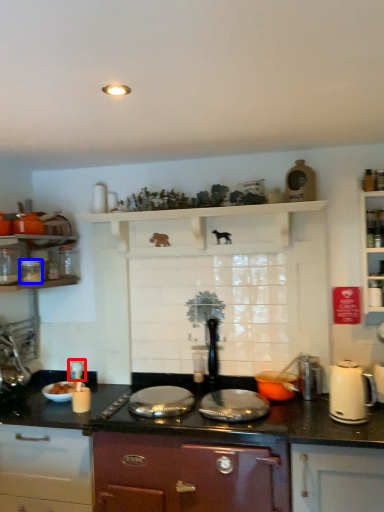
Question: Which object appears closest to the camera in this image, appliance (highlighted by a red box) or kitchen appliance (highlighted by a blue box)?

Choices:
 (A) appliance
 (B) kitchen appliance

Answer: (B)